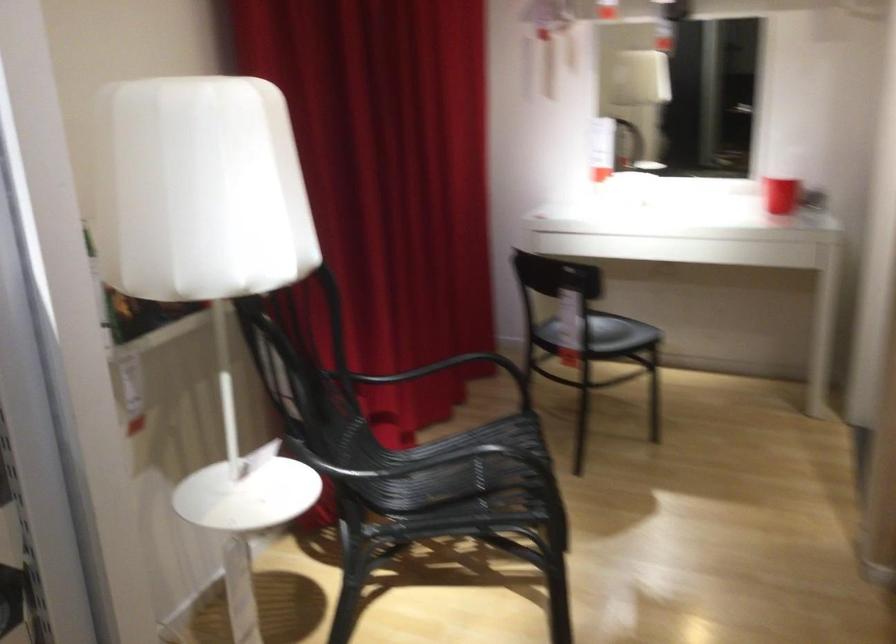
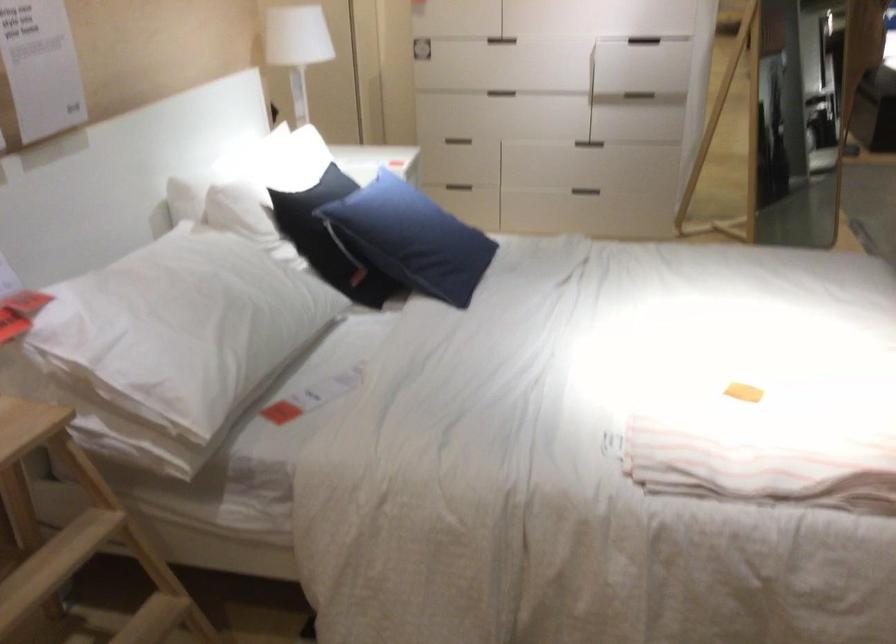
The first image is from the beginning of the video and the second image is from the end. How did the camera likely rotate when shooting the video?

The rotation direction of the camera is right-down.